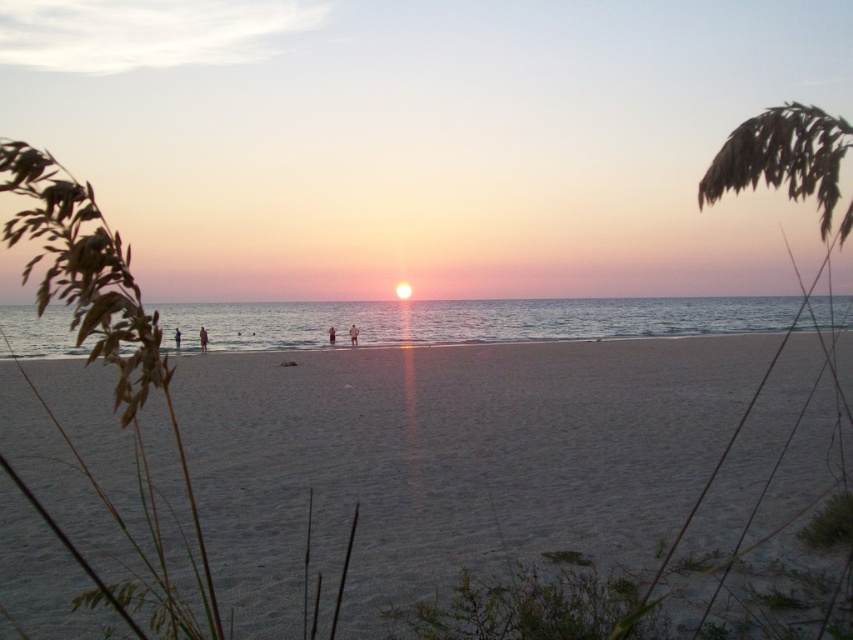
You are standing at the point marked as point (177,337) on the beach. What is the nearest object to you?

The nearest object to you is the dark blue fabric person at center, as the point (177,337) indicates their location.

You are standing on the beach and want to reach the white sandy beach at center. What direction should you move in?

You should move towards the center of the beach to reach the white sandy beach at center.